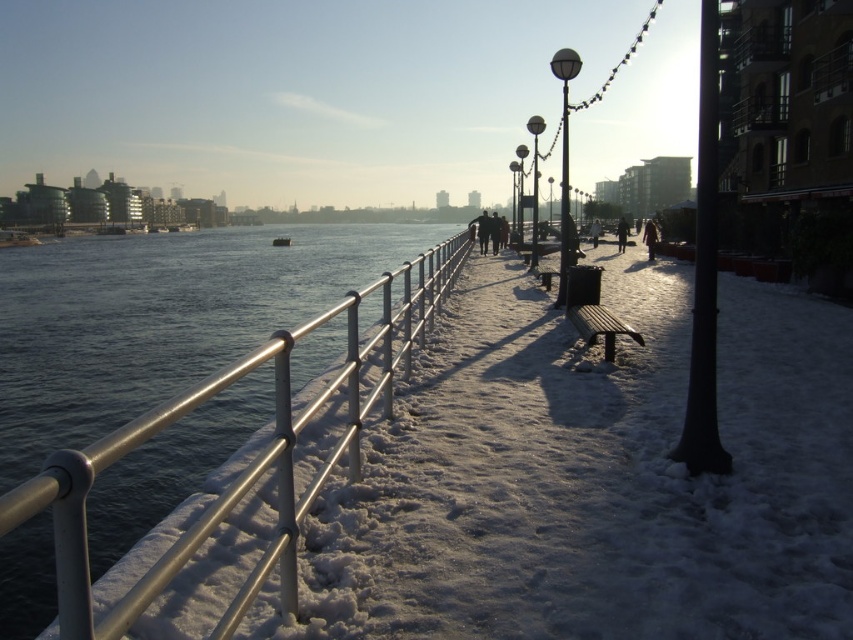
You are standing on the snow covered pathway in the winter scene. You see a point marked at coordinates (189,429). What object is located at that point?

The point at coordinates (189,429) marks the location of the brushed metal railing at left.

You are standing at the snow covered pathway in the winter scene. You see two points in the image, one at point (712, 368) and the other at point (529, 116). Which point is closer to you?

Point (712, 368) is closer to the camera than point (529, 116).